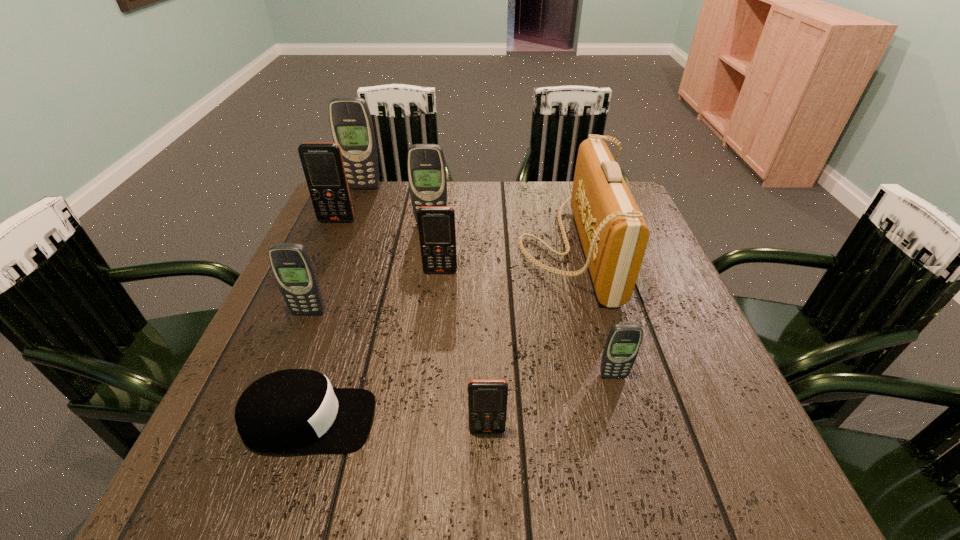
Image resolution: width=960 pixels, height=540 pixels. Identify the location of the second nearest orange cellular telephone. (437, 233).

Identify the location of the sixth cellular telephone from left to right. (487, 398).

The width and height of the screenshot is (960, 540). I want to click on the nearest cellular telephone, so click(487, 398).

Image resolution: width=960 pixels, height=540 pixels. I want to click on the smallest gray cellular telephone, so click(623, 342).

The height and width of the screenshot is (540, 960). In order to click on the rightmost gray cellular telephone in this screenshot , I will do `click(623, 342)`.

Where is `cap`? The width and height of the screenshot is (960, 540). cap is located at coordinates (289, 411).

This screenshot has height=540, width=960. Find the location of `black cap`. black cap is located at coordinates (289, 411).

Image resolution: width=960 pixels, height=540 pixels. In order to click on vacant space located 0.370m on the screen of the tallest cellular telephone in this screenshot , I will do `click(332, 268)`.

This screenshot has width=960, height=540. Identify the location of vacant area located 0.220m on the decorative side of the handbag. (432, 248).

This screenshot has height=540, width=960. Find the location of `vacant space located 0.210m on the decorative side of the handbag`. vacant space located 0.210m on the decorative side of the handbag is located at coordinates (436, 248).